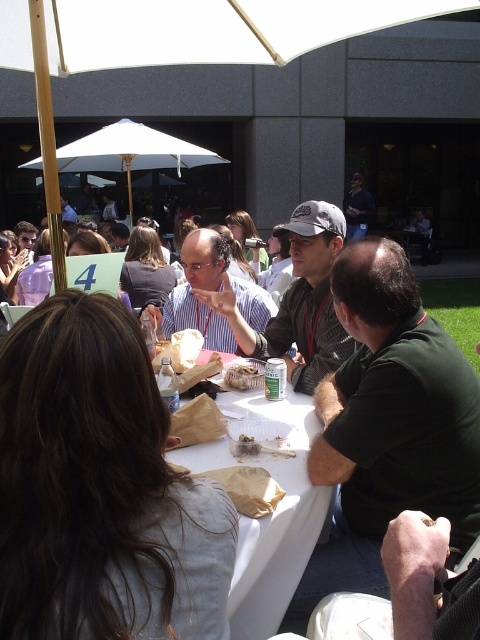
You are standing at the point marked by the coordinates point (388, 422). What is the color of the shirt of the person sitting at the center of the image?

→ The point (388, 422) marks dark green shirt at center, so the color of the shirt is dark green.

You are a photographer at the event and want to ensure both the dark green shirt at center and the matte white shirt at center are visible in your photo. Since you can adjust the camera angle, which shirt should you angle the camera down to focus on to ensure the shorter one is fully visible?

The dark green shirt at center is much taller than the matte white shirt at center. To ensure the shorter matte white shirt at center is fully visible, angle the camera down towards it.

You are a photographer at the event and need to capture a clear shot of the matte black shirt at center and the brown paper bag at table. Which object should you focus on first to ensure it appears larger in the photo?

The matte black shirt at center should be focused on first because it is much taller than the brown paper bag at table, making it naturally appear larger in the photo.